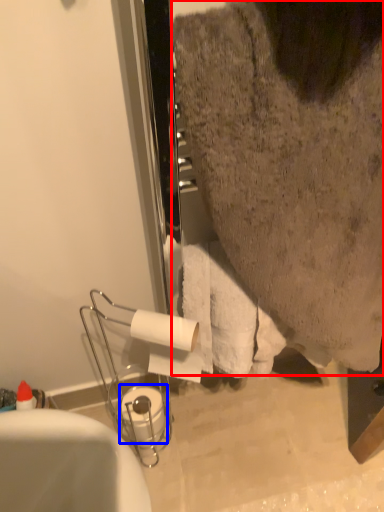
Question: Which object is further to the camera taking this photo, person (highlighted by a red box) or toilet paper (highlighted by a blue box)?

Choices:
 (A) person
 (B) toilet paper

Answer: (B)